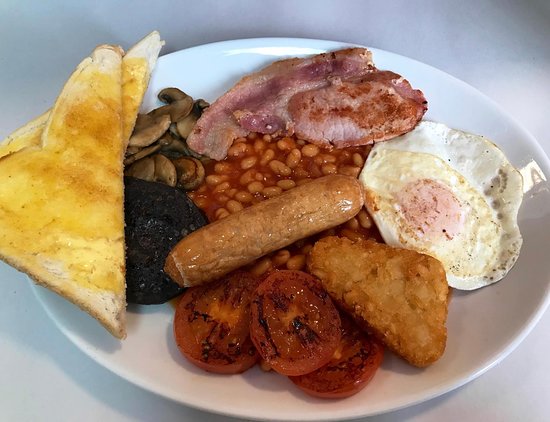
Identify the location of plate. This screenshot has width=550, height=422. (438, 112).